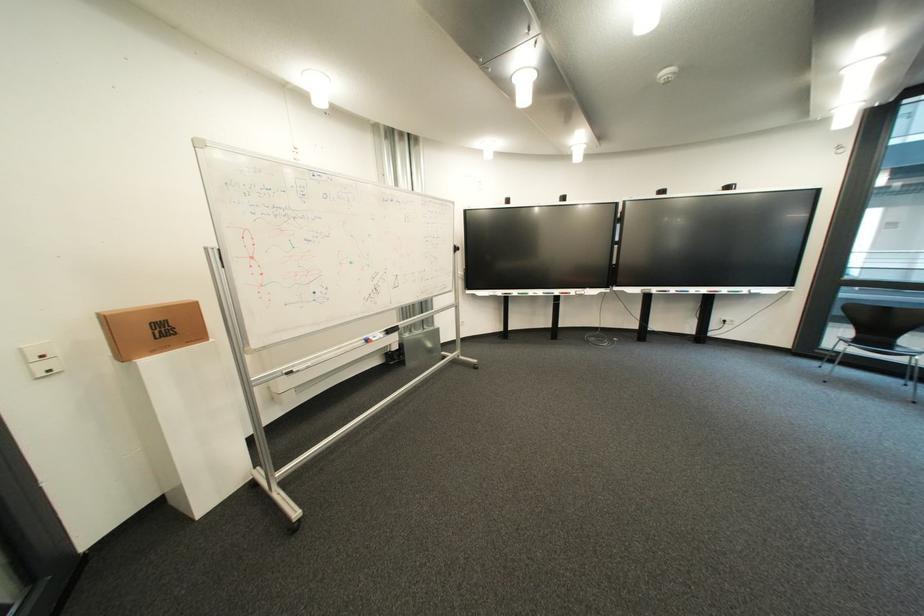
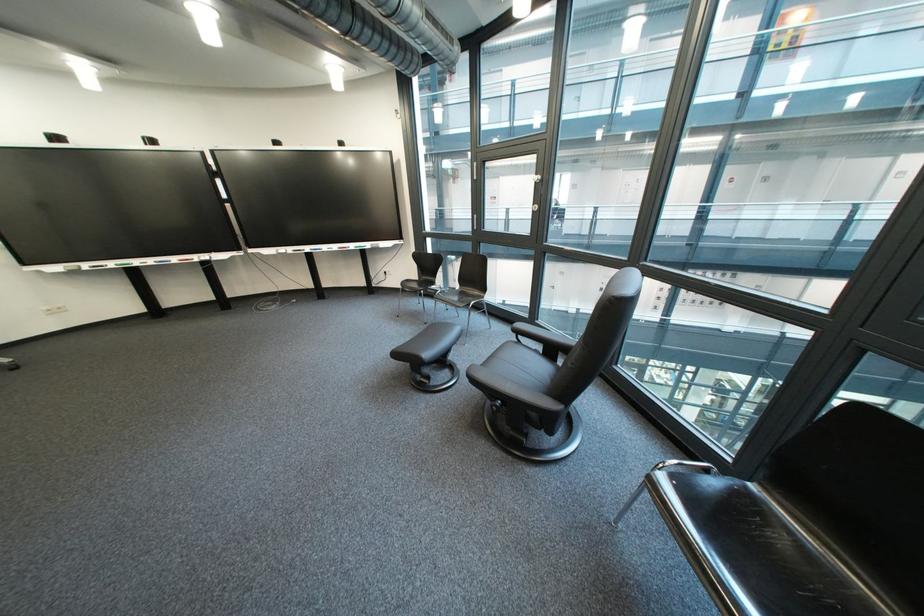
In the second image, find the point that corresponds to the point at 556,294 in the first image.

(169, 264)